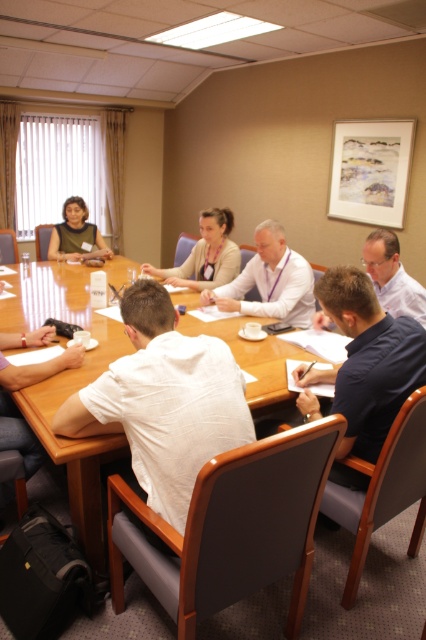
Question: Which point is closer to the camera?

Choices:
 (A) light blue shirt at center
 (B) wooden table at center
 (C) dark blue shirt at lower right

Answer: (B)

Question: Which point is farther from the camera taking this photo?

Choices:
 (A) (100, 241)
 (B) (342, 477)

Answer: (A)

Question: Can you confirm if white shirt at center is bigger than matte beige sweater at center?

Choices:
 (A) yes
 (B) no

Answer: (B)

Question: Is dark blue shirt at lower right bigger than white shirt at center?

Choices:
 (A) no
 (B) yes

Answer: (B)

Question: Among these objects, which one is farthest from the camera?

Choices:
 (A) wooden table at center
 (B) matte black shirt at upper left
 (C) matte beige sweater at center

Answer: (B)

Question: Is white shirt at center positioned behind light blue shirt at center?

Choices:
 (A) no
 (B) yes

Answer: (B)